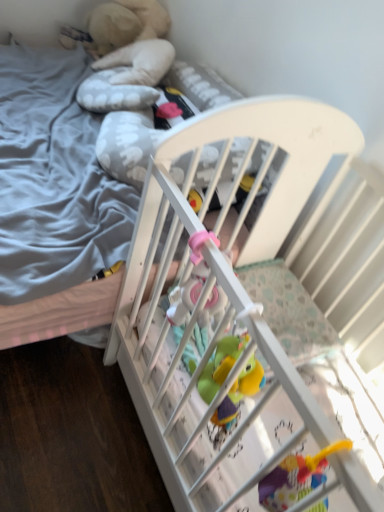
Question: Is pink rubber toy at center inside or outside of white wooden crib at center?

Choices:
 (A) outside
 (B) inside

Answer: (A)

Question: Is pink rubber toy at center taller or shorter than white wooden crib at center?

Choices:
 (A) tall
 (B) short

Answer: (A)

Question: Does point (221, 310) appear closer or farther from the camera than point (155, 159)?

Choices:
 (A) farther
 (B) closer

Answer: (B)

Question: Based on their sizes in the image, would you say white wooden crib at center is bigger or smaller than pink rubber toy at center?

Choices:
 (A) small
 (B) big

Answer: (B)

Question: Is point (208, 419) positioned closer to the camera than point (183, 288)?

Choices:
 (A) farther
 (B) closer

Answer: (A)

Question: Looking at their shapes, would you say white wooden crib at center is wider or thinner than pink rubber toy at center?

Choices:
 (A) thin
 (B) wide

Answer: (B)

Question: From a real-world perspective, is white wooden crib at center physically located above or below pink rubber toy at center?

Choices:
 (A) below
 (B) above

Answer: (A)